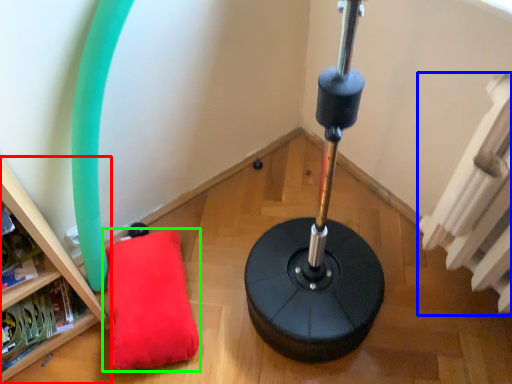
Question: Considering the real-world distances, which object is farthest from furniture (highlighted by a red box)? radiator (highlighted by a blue box) or pillow (highlighted by a green box)?

Choices:
 (A) radiator
 (B) pillow

Answer: (A)